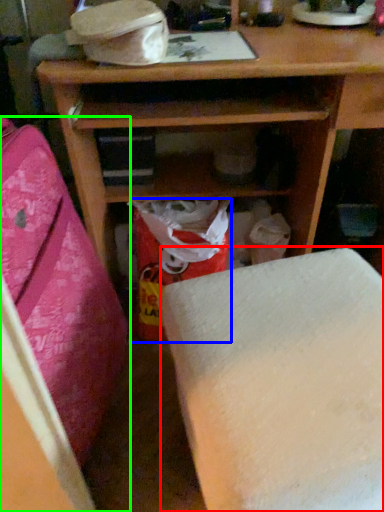
Question: Which object is positioned farthest from furniture (highlighted by a red box)? Select from shopping bag (highlighted by a blue box) and furniture (highlighted by a green box).

Choices:
 (A) shopping bag
 (B) furniture

Answer: (A)